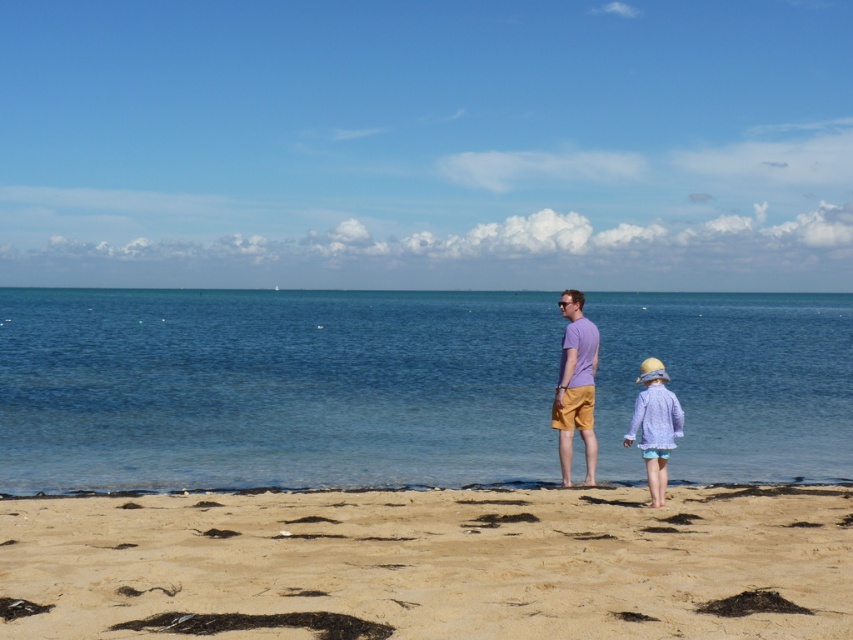
Which is in front, point (102, 464) or point (660, 486)?

Point (660, 486)

Does clear blue water at center appear under light purple cotton dress at lower right?

No, clear blue water at center is not below light purple cotton dress at lower right.

Is point (35, 349) less distant than point (680, 426)?

No, it is behind (680, 426).

The image size is (853, 640). Find the location of `clear blue water at center`. clear blue water at center is located at coordinates (274, 387).

Can you confirm if light brown sandy beach at lower center is shorter than purple cotton shirt at center?

Yes, light brown sandy beach at lower center is shorter than purple cotton shirt at center.

The width and height of the screenshot is (853, 640). Describe the element at coordinates (428, 563) in the screenshot. I see `light brown sandy beach at lower center` at that location.

Describe the element at coordinates (428, 563) in the screenshot. The image size is (853, 640). I see `light brown sandy beach at lower center` at that location.

Locate an element on the screen. light brown sandy beach at lower center is located at coordinates click(x=428, y=563).

Is light brown sandy beach at lower center positioned before light purple cotton dress at lower right?

Yes, light brown sandy beach at lower center is in front of light purple cotton dress at lower right.

Who is taller, light brown sandy beach at lower center or light purple cotton dress at lower right?

light purple cotton dress at lower right is taller.

This screenshot has height=640, width=853. Describe the element at coordinates (428, 563) in the screenshot. I see `light brown sandy beach at lower center` at that location.

Where is `light brown sandy beach at lower center`? This screenshot has height=640, width=853. light brown sandy beach at lower center is located at coordinates (428, 563).